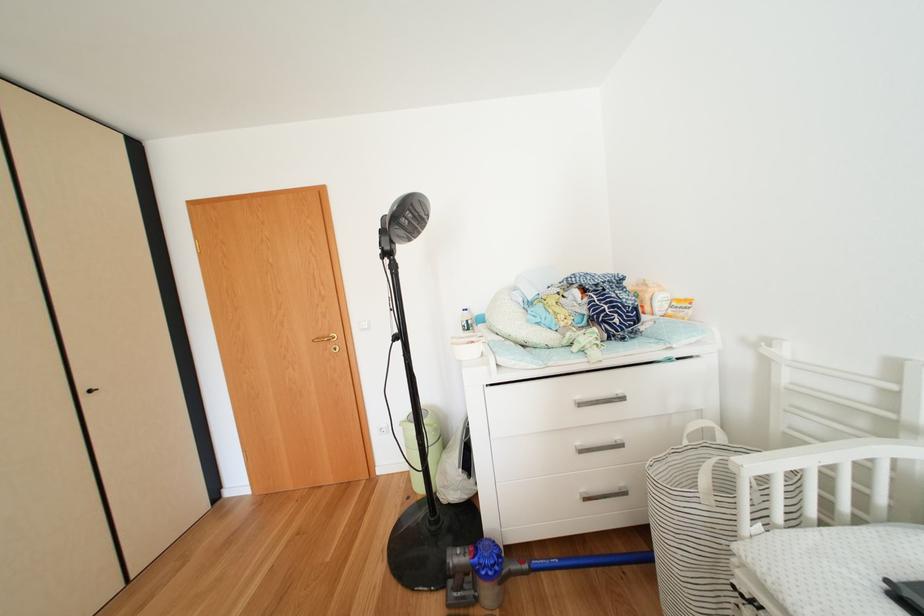
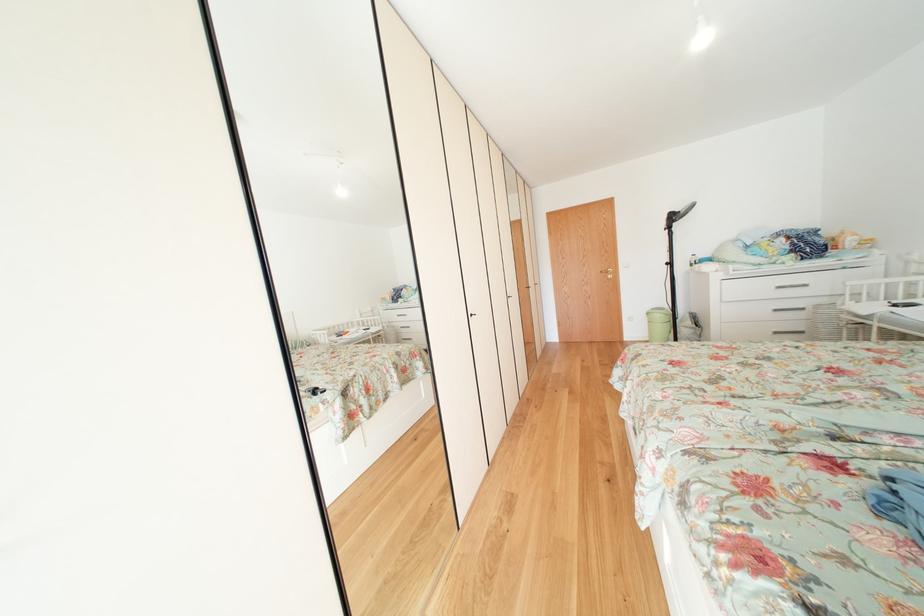
The images are taken continuously from a first-person perspective. In which direction are you moving?

The movement direction of the cameraman is left, backward.